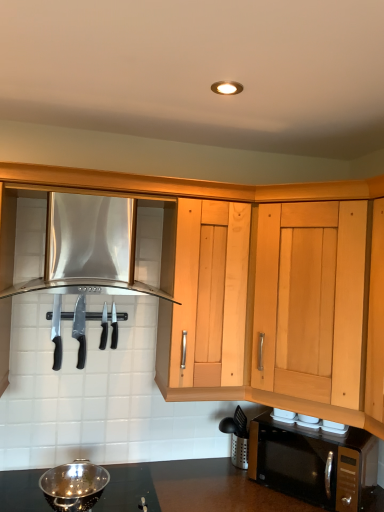
Question: From a real-world perspective, is black matte microwave at lower right on top of stainless steel range hood at upper left, the 2th cabinetry from the right?

Choices:
 (A) no
 (B) yes

Answer: (A)

Question: Is black matte microwave at lower right positioned with its back to stainless steel range hood at upper left, the 2th cabinetry from the right?

Choices:
 (A) yes
 (B) no

Answer: (B)

Question: Does black matte microwave at lower right have a larger size compared to stainless steel range hood at upper left, the 2th cabinetry from the right?

Choices:
 (A) no
 (B) yes

Answer: (A)

Question: Does black matte microwave at lower right touch stainless steel range hood at upper left, the 2th cabinetry from the right?

Choices:
 (A) yes
 (B) no

Answer: (B)

Question: Is black matte microwave at lower right shorter than stainless steel range hood at upper left, marked as the first cabinetry in a left-to-right arrangement?

Choices:
 (A) no
 (B) yes

Answer: (B)

Question: Is point (105, 331) positioned closer to the camera than point (13, 293)?

Choices:
 (A) farther
 (B) closer

Answer: (A)

Question: Based on their positions, is black plastic knife at center, arranged as the second silverware when viewed from the right, located to the left or right of stainless steel range hood at upper left, the 2th cabinetry from the right?

Choices:
 (A) right
 (B) left

Answer: (A)

Question: From the image's perspective, is black plastic knife at center, the first silverware viewed from the left, above or below stainless steel range hood at upper left, marked as the first cabinetry in a left-to-right arrangement?

Choices:
 (A) above
 (B) below

Answer: (B)

Question: In terms of height, does black plastic knife at center, arranged as the second silverware when viewed from the right, look taller or shorter compared to stainless steel range hood at upper left, marked as the first cabinetry in a left-to-right arrangement?

Choices:
 (A) short
 (B) tall

Answer: (A)

Question: Looking at the image, does black plastic knife at center, arranged as the second silverware when viewed from the right, seem bigger or smaller compared to polished stainless steel knife at center, which is counted as the 1th silverware, starting from the right?

Choices:
 (A) small
 (B) big

Answer: (B)

Question: Considering the positions of point coord(102,318) and point coord(112,348), is point coord(102,318) closer or farther from the camera than point coord(112,348)?

Choices:
 (A) closer
 (B) farther

Answer: (A)

Question: Considering the positions of black plastic knife at center, the first silverware viewed from the left, and polished stainless steel knife at center, the 2th silverware positioned from the left, in the image, is black plastic knife at center, the first silverware viewed from the left, taller or shorter than polished stainless steel knife at center, the 2th silverware positioned from the left,?

Choices:
 (A) tall
 (B) short

Answer: (B)

Question: Is black plastic knife at center, arranged as the second silverware when viewed from the right, spatially inside polished stainless steel knife at center, which is counted as the 1th silverware, starting from the right, or outside of it?

Choices:
 (A) inside
 (B) outside

Answer: (B)

Question: Does point (54, 333) appear closer or farther from the camera than point (114, 317)?

Choices:
 (A) closer
 (B) farther

Answer: (A)

Question: Looking at their shapes, would you say black plastic knife at left, which appears as the second knife when viewed from the right, is wider or thinner than polished stainless steel knife at center, the 2th silverware positioned from the left?

Choices:
 (A) thin
 (B) wide

Answer: (A)